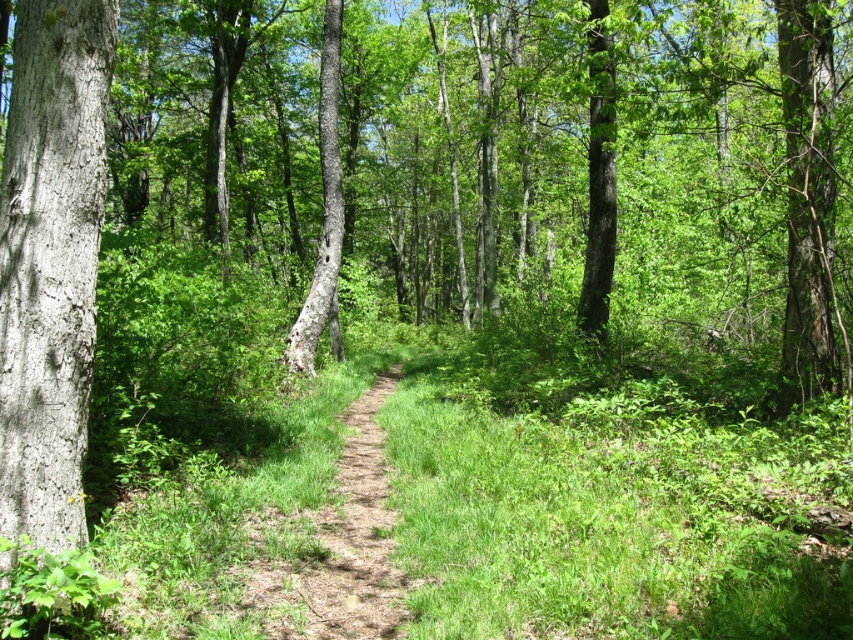
Does smooth gray bark at left have a greater height compared to brown dirt path at center?

Yes, smooth gray bark at left is taller than brown dirt path at center.

Can you confirm if smooth gray bark at left is bigger than brown dirt path at center?

No, smooth gray bark at left is not bigger than brown dirt path at center.

At what (x,y) coordinates should I click in order to perform the action: click on smooth gray bark at left. Please return your answer as a coordinate pair (x, y). The width and height of the screenshot is (853, 640). Looking at the image, I should click on (50, 301).

Is smooth gray bark at left above smooth bark tree at center?

No, smooth gray bark at left is not above smooth bark tree at center.

Between point (39, 502) and point (329, 157), which one is positioned in front?

Positioned in front is point (39, 502).

Image resolution: width=853 pixels, height=640 pixels. I want to click on smooth gray bark at left, so click(x=50, y=301).

Is brown dirt path at center bigger than smooth bark tree at center?

No.

Between point (347, 561) and point (305, 352), which one is positioned behind?

Point (305, 352)

The width and height of the screenshot is (853, 640). Find the location of `brown dirt path at center`. brown dirt path at center is located at coordinates (357, 536).